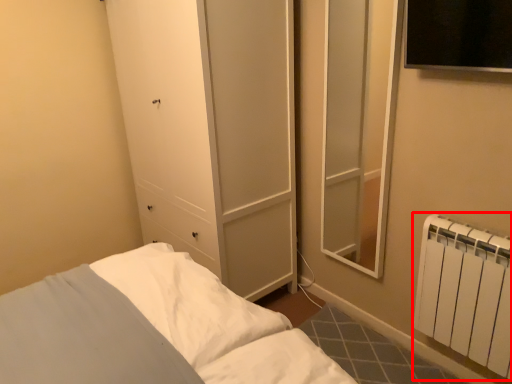
Question: From the image's perspective, considering the relative positions of radiator (annotated by the red box) and pillow in the image provided, where is radiator (annotated by the red box) located with respect to the staircase?

Choices:
 (A) above
 (B) below

Answer: (A)